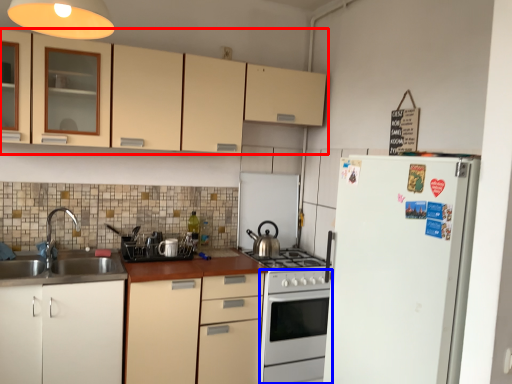
Question: Among these objects, which one is farthest to the camera, cabinetry (highlighted by a red box) or oven (highlighted by a blue box)?

Choices:
 (A) cabinetry
 (B) oven

Answer: (B)